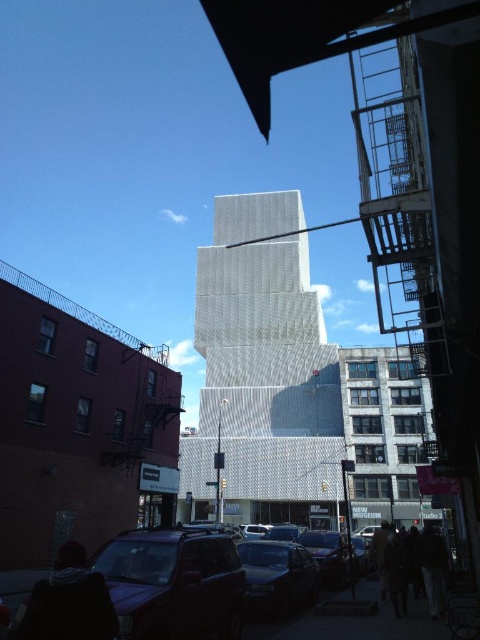
Question: Can you confirm if matte black suv at lower left is positioned to the left of metallic silver car at center?

Choices:
 (A) yes
 (B) no

Answer: (A)

Question: Which object is farther from the camera taking this photo?

Choices:
 (A) dark gray hoodie at lower left
 (B) metallic silver car at center

Answer: (B)

Question: Which is nearer to the metallic silver car at center?

Choices:
 (A) dark gray hoodie at lower left
 (B) matte black suv at lower left

Answer: (B)

Question: Which of the following is the closest to the observer?

Choices:
 (A) (288, 586)
 (B) (132, 561)

Answer: (B)

Question: Can you confirm if matte black suv at lower left is positioned to the right of dark gray hoodie at lower left?

Choices:
 (A) no
 (B) yes

Answer: (A)

Question: Is matte black suv at lower left thinner than metallic silver car at center?

Choices:
 (A) yes
 (B) no

Answer: (B)